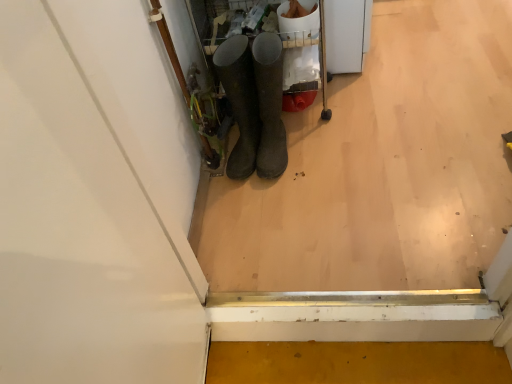
This screenshot has width=512, height=384. Find the location of `free space to the right of dark brown rubber boots at center`. free space to the right of dark brown rubber boots at center is located at coordinates (329, 145).